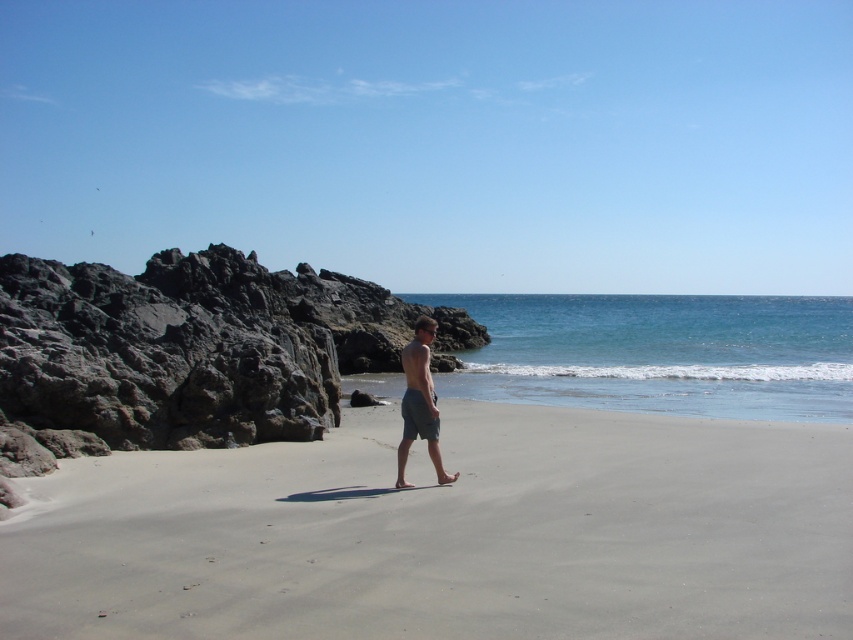
Is gray sand at center closer to camera compared to gray cotton shorts at center?

Yes, gray sand at center is closer to the viewer.

From the picture: Measure the distance between gray sand at center and gray cotton shorts at center.

The distance of gray sand at center from gray cotton shorts at center is 7.23 feet.

Between point (531, 529) and point (421, 369), which one is positioned behind?

Positioned behind is point (421, 369).

Identify the location of gray sand at center. coord(447,532).